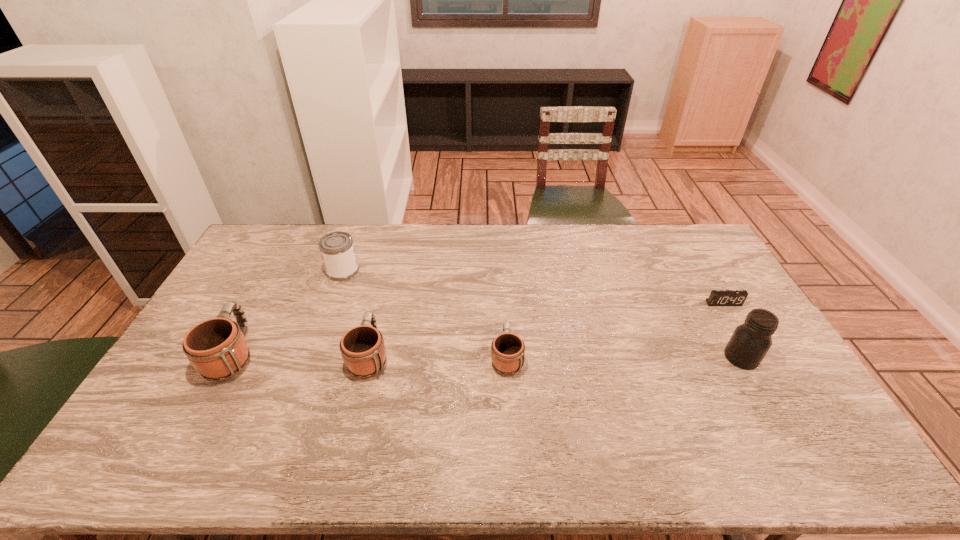
Locate an element on the screen. This screenshot has width=960, height=540. free space between the fifth object from right to left and the rightmost mug is located at coordinates (424, 314).

Locate an element on the screen. The width and height of the screenshot is (960, 540). free space between the leftmost mug and the tallest object is located at coordinates (488, 356).

Find the location of a particular element. This screenshot has width=960, height=540. object identified as the fourth closest to the jar is located at coordinates tap(337, 250).

At what (x,y) coordinates should I click in order to perform the action: click on object that is the closest to the fifth tallest object. Please return your answer as a coordinate pair (x, y). This screenshot has width=960, height=540. Looking at the image, I should click on (363, 350).

Locate which mug ranks in proximity to the second mug from right to left. Please provide its 2D coordinates. Your answer should be formatted as a tuple, i.e. [(x, y)], where the tuple contains the x and y coordinates of a point satisfying the conditions above.

[(216, 348)]

Point out which mug is positioned as the nearest to the third shortest object. Please provide its 2D coordinates. Your answer should be formatted as a tuple, i.e. [(x, y)], where the tuple contains the x and y coordinates of a point satisfying the conditions above.

[(216, 348)]